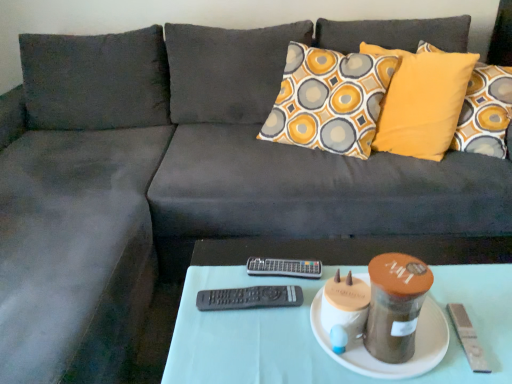
Question: From a real-world perspective, is white ceramic plate at center above or below black plastic remote at center, the second remote when ordered from back to front?

Choices:
 (A) above
 (B) below

Answer: (B)

Question: Is white ceramic plate at center wider or thinner than black plastic remote at center, the 1th remote when ordered from front to back?

Choices:
 (A) thin
 (B) wide

Answer: (B)

Question: Which object is positioned farthest from the black plastic remote at center, marked as the second remote in a bottom-to-top arrangement?

Choices:
 (A) white fabric table at center
 (B) black plastic remote at center, marked as the 2th remote in a top-to-bottom arrangement
 (C) white ceramic plate at center

Answer: (C)

Question: Estimate the real-world distances between objects in this image. Which object is farther from the white fabric table at center?

Choices:
 (A) black plastic remote at center, placed as the first remote when sorted from back to front
 (B) white ceramic plate at center
 (C) black plastic remote at center, the 1th remote when ordered from bottom to top

Answer: (A)